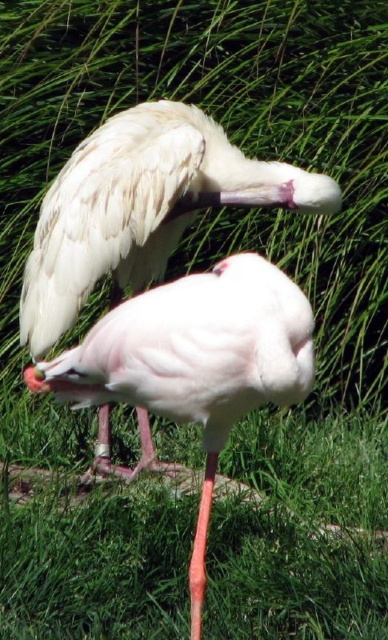
Question: Is smooth white bird at center thinner than smooth pink flamingo at center?

Choices:
 (A) no
 (B) yes

Answer: (A)

Question: Can you confirm if smooth white bird at center is positioned to the left of smooth pink flamingo at center?

Choices:
 (A) yes
 (B) no

Answer: (A)

Question: Which point appears farthest from the camera in this image?

Choices:
 (A) (138, 362)
 (B) (71, 209)

Answer: (B)

Question: Which of the following is the closest to the observer?

Choices:
 (A) pos(124,192)
 (B) pos(221,424)

Answer: (B)

Question: Does smooth white bird at center appear on the right side of smooth pink flamingo at center?

Choices:
 (A) no
 (B) yes

Answer: (A)